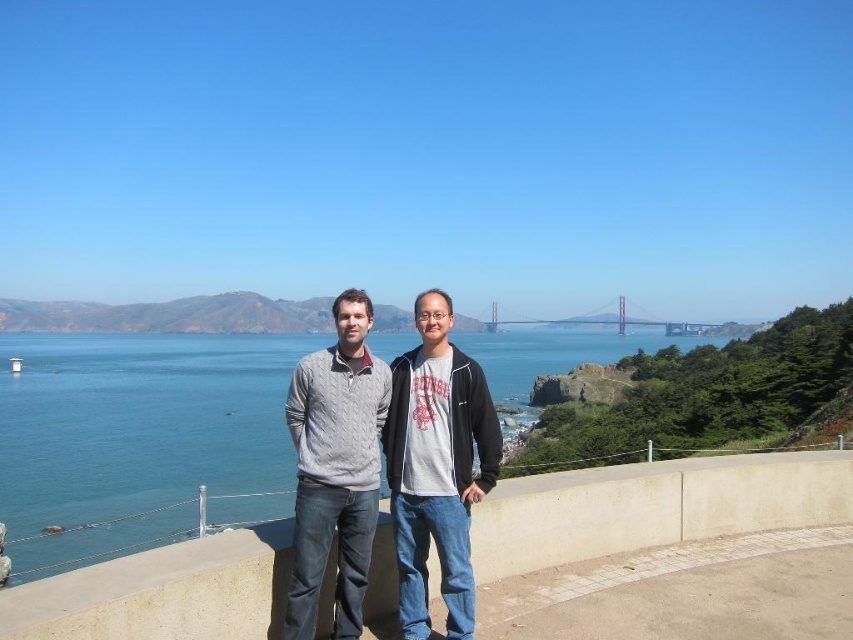
Between concrete ledge at center and knit sweater at center, which one is positioned higher?

knit sweater at center is above.

From the picture: Can you confirm if concrete ledge at center is wider than knit sweater at center?

Yes.

The height and width of the screenshot is (640, 853). What do you see at coordinates (653, 506) in the screenshot? I see `concrete ledge at center` at bounding box center [653, 506].

Find the location of `concrete ledge at center`. concrete ledge at center is located at coordinates (653, 506).

Can you confirm if blue water at center is thinner than knit sweater at center?

In fact, blue water at center might be wider than knit sweater at center.

You are a GUI agent. You are given a task and a screenshot of the screen. Output one action in this format:
    pyautogui.click(x=<x>, y=<y>)
    Task: Click on the blue water at center
    Image resolution: width=853 pixels, height=640 pixels.
    Given the screenshot: What is the action you would take?
    pyautogui.click(x=138, y=440)

Which is behind, point (828, 465) or point (712, 323)?

Point (712, 323)

Find the location of a particular element. The image size is (853, 640). concrete ledge at center is located at coordinates (653, 506).

Is point (758, 483) behind point (695, 324)?

No, (758, 483) is closer to viewer.

I want to click on concrete ledge at center, so click(653, 506).